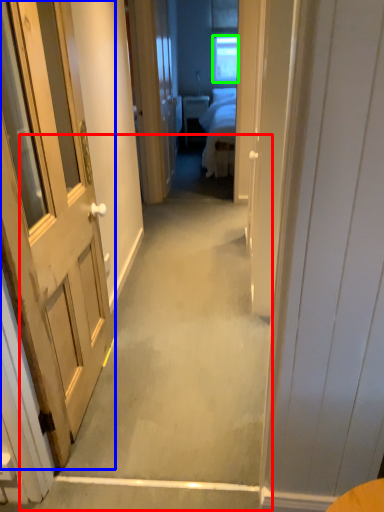
Question: Based on their relative distances, which object is farther from path (highlighted by a red box)? Choose from door (highlighted by a blue box) and window (highlighted by a green box).

Choices:
 (A) door
 (B) window

Answer: (B)